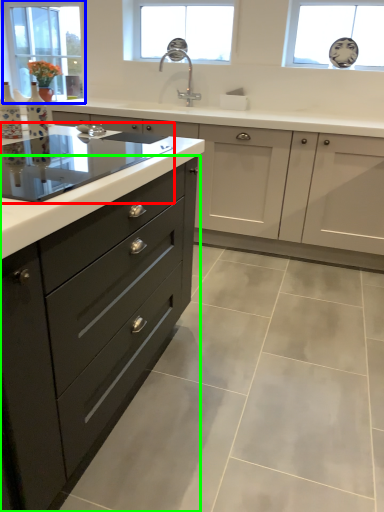
Question: Which object is positioned closest to home appliance (highlighted by a red box)? Select from window (highlighted by a blue box) and drawer (highlighted by a green box).

Choices:
 (A) window
 (B) drawer

Answer: (B)